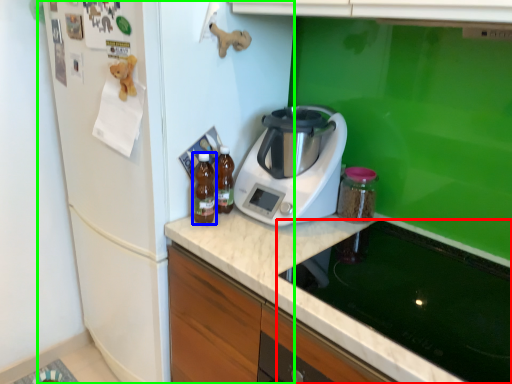
Question: Which is farther away from home appliance (highlighted by a red box)? kitchen appliance (highlighted by a blue box) or fridge (highlighted by a green box)?

Choices:
 (A) kitchen appliance
 (B) fridge

Answer: (B)